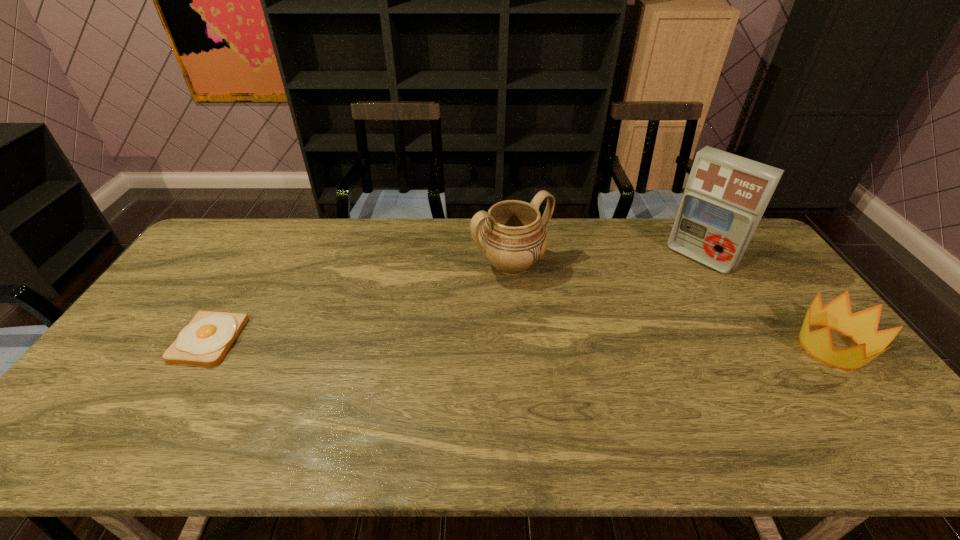
This screenshot has height=540, width=960. I want to click on vacant spot on the desktop that is between the shortest object and the rightmost object and is positioned on the front-facing side of the first-aid kit, so click(608, 345).

Where is `free spot on the desktop that is between the shortest object and the third tallest object and is positioned on the front-facing side of the urn`? This screenshot has height=540, width=960. free spot on the desktop that is between the shortest object and the third tallest object and is positioned on the front-facing side of the urn is located at coordinates (594, 344).